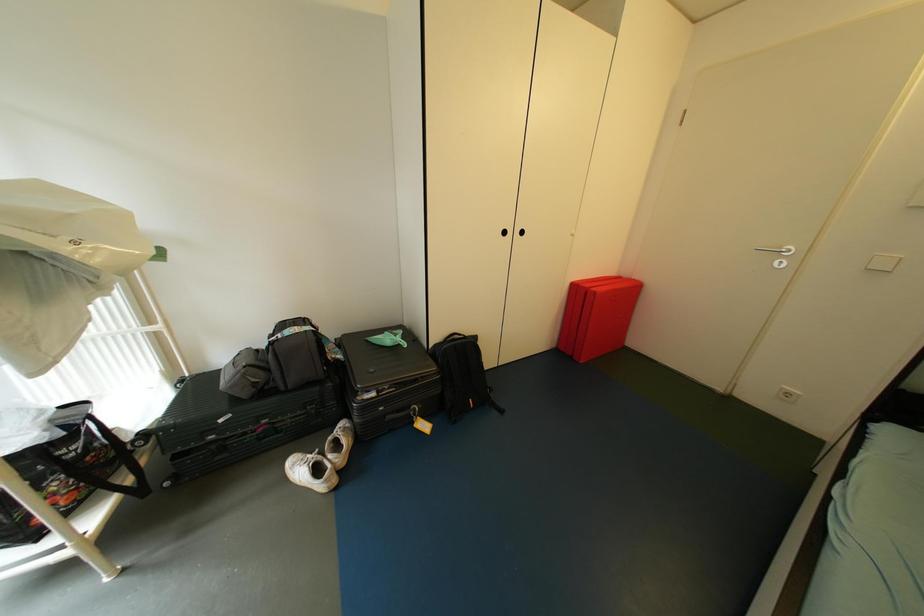
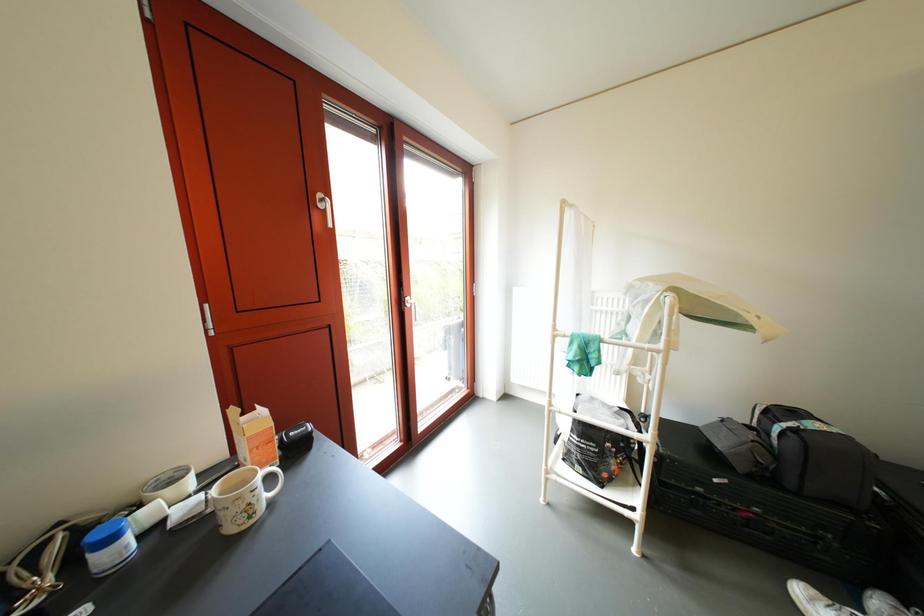
Question: The camera is either moving clockwise (left) or counter-clockwise (right) around the object. The first image is from the beginning of the video and the second image is from the end. Is the camera moving left or right when shooting the video?

Choices:
 (A) Left
 (B) Right

Answer: (B)